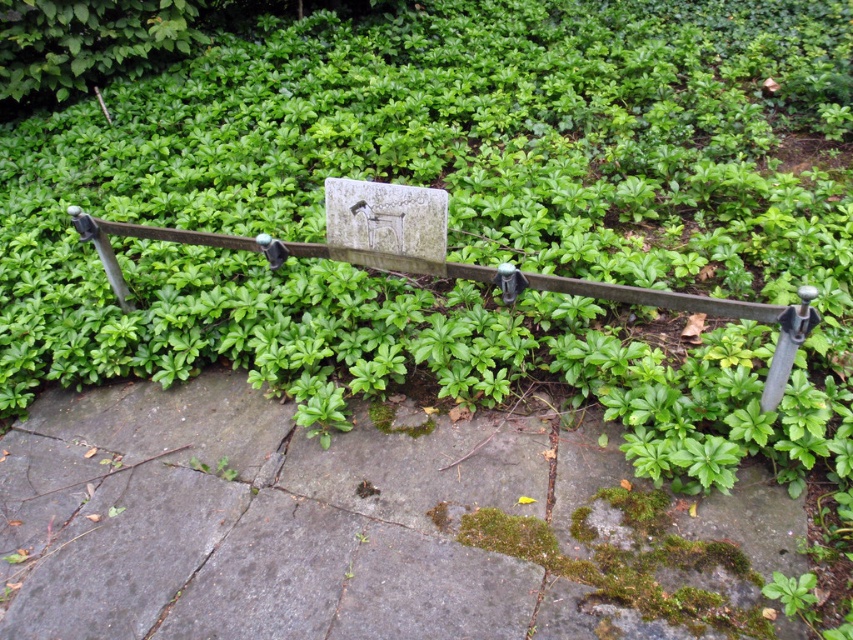
Question: Among these objects, which one is nearest to the camera?

Choices:
 (A) mossy stone pavement at center
 (B) green leafy bush at upper left

Answer: (A)

Question: Is the position of green metal fence at center less distant than that of green leafy bush at upper left?

Choices:
 (A) yes
 (B) no

Answer: (A)

Question: Where is mossy stone pavement at center located in relation to green metal fence at center in the image?

Choices:
 (A) left
 (B) right

Answer: (A)

Question: Based on their relative distances, which object is nearer to the green metal fence at center?

Choices:
 (A) green leafy bush at upper left
 (B) mossy stone pavement at center

Answer: (B)

Question: Is mossy stone pavement at center further to the viewer compared to green leafy bush at upper left?

Choices:
 (A) yes
 (B) no

Answer: (B)

Question: Which point is farther from the camera taking this photo?

Choices:
 (A) (722, 529)
 (B) (764, 307)
 (C) (134, 12)

Answer: (C)